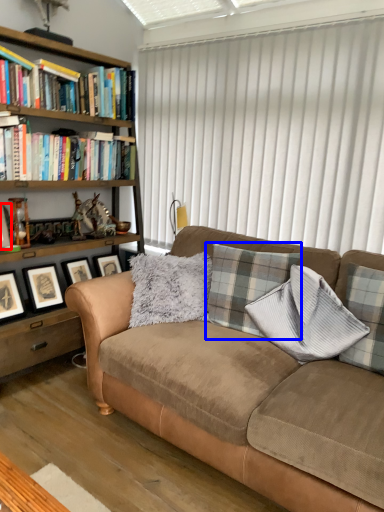
Question: Which point is closer to the camera, picture frame (highlighted by a red box) or plaid (highlighted by a blue box)?

Choices:
 (A) picture frame
 (B) plaid

Answer: (B)